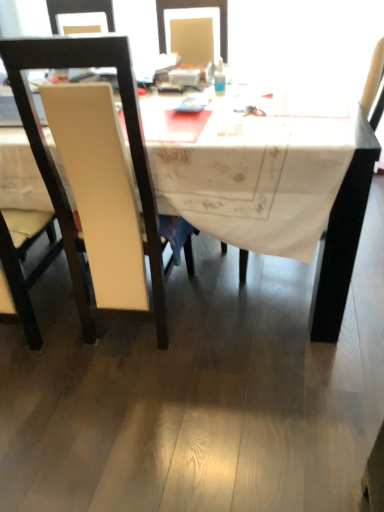
This screenshot has width=384, height=512. What do you see at coordinates (59, 176) in the screenshot?
I see `white leather chair at left, positioned as the 2th chair in left-to-right order` at bounding box center [59, 176].

Locate an element on the screen. translucent plastic bottle at upper center is located at coordinates (219, 79).

Identify the location of white leather chair at left, placed as the first chair when sorted from right to left. (59, 176).

Considering the relative sizes of white fabric table at center and white leather chair at left, placed as the first chair when sorted from right to left, in the image provided, is white fabric table at center wider than white leather chair at left, placed as the first chair when sorted from right to left,?

Yes, white fabric table at center is wider than white leather chair at left, placed as the first chair when sorted from right to left.

Looking at this image, in terms of size, does white fabric table at center appear bigger or smaller than white leather chair at left, placed as the first chair when sorted from right to left?

Clearly, white fabric table at center is larger in size than white leather chair at left, placed as the first chair when sorted from right to left.

Is point (370, 128) farther from viewer compared to point (81, 262)?

No, it is in front of (81, 262).

Could you measure the distance between white leather chair at left, positioned as the 2th chair in left-to-right order, and white fabric table at center?

27.67 inches.

Is white leather chair at left, positioned as the 2th chair in left-to-right order, at the right side of white fabric table at center?

Indeed, white leather chair at left, positioned as the 2th chair in left-to-right order, is positioned on the right side of white fabric table at center.

From a real-world perspective, which is physically above, white leather chair at left, placed as the first chair when sorted from right to left, or white fabric table at center?

white leather chair at left, placed as the first chair when sorted from right to left, from a real-world perspective.

Is point (36, 41) positioned in front of point (362, 124)?

Yes, it is in front of point (362, 124).

From the image's perspective, is translucent plastic bottle at upper center positioned above or below white leather chair at left, positioned as the 2th chair in left-to-right order?

translucent plastic bottle at upper center is above white leather chair at left, positioned as the 2th chair in left-to-right order.

Which of these two, translucent plastic bottle at upper center or white leather chair at left, positioned as the 2th chair in left-to-right order, is smaller?

translucent plastic bottle at upper center is smaller.

Which is behind, translucent plastic bottle at upper center or white leather chair at left, placed as the first chair when sorted from right to left?

Positioned behind is translucent plastic bottle at upper center.

How far apart are translucent plastic bottle at upper center and white leather chair at left, placed as the first chair when sorted from right to left?

translucent plastic bottle at upper center is 29.55 inches away from white leather chair at left, placed as the first chair when sorted from right to left.

How different are the orientations of white matte chair at left, which is the 2th chair in right-to-left order, and translucent plastic bottle at upper center in degrees?

The facing directions of white matte chair at left, which is the 2th chair in right-to-left order, and translucent plastic bottle at upper center are 5.8 degrees apart.

Image resolution: width=384 pixels, height=512 pixels. I want to click on bottle behind the white matte chair at left, the first chair in the left-to-right sequence, so (219, 79).

Considering the points (18, 42) and (217, 77), which point is behind, point (18, 42) or point (217, 77)?

The point (217, 77) is farther.

Considering the sizes of objects white leather chair at left, placed as the first chair when sorted from right to left, and white matte chair at left, the first chair in the left-to-right sequence, in the image provided, who is bigger, white leather chair at left, placed as the first chair when sorted from right to left, or white matte chair at left, the first chair in the left-to-right sequence,?

white leather chair at left, placed as the first chair when sorted from right to left, is bigger.

Is white leather chair at left, positioned as the 2th chair in left-to-right order, oriented towards white matte chair at left, the first chair in the left-to-right sequence?

No, white leather chair at left, positioned as the 2th chair in left-to-right order, is not oriented towards white matte chair at left, the first chair in the left-to-right sequence.

Is white leather chair at left, placed as the first chair when sorted from right to left, positioned far away from white matte chair at left, which is the 2th chair in right-to-left order?

They are positioned close to each other.

From a real-world perspective, is translucent plastic bottle at upper center physically located above or below white fabric table at center?

In terms of real-world spatial position, translucent plastic bottle at upper center is above white fabric table at center.

Is translucent plastic bottle at upper center aimed at white fabric table at center?

No, translucent plastic bottle at upper center is not turned towards white fabric table at center.

You are a GUI agent. You are given a task and a screenshot of the screen. Output one action in this format:
    pyautogui.click(x=<x>, y=<y>)
    Task: Click on the desk below the translucent plastic bottle at upper center (from the image's perspective)
    The width and height of the screenshot is (384, 512).
    Given the screenshot: What is the action you would take?
    pyautogui.click(x=343, y=237)

Is the depth of translucent plastic bottle at upper center greater than that of white fabric table at center?

Yes, it is behind white fabric table at center.

Choose the correct answer: Is white fabric table at center inside translucent plastic bottle at upper center or outside it?

white fabric table at center is not enclosed by translucent plastic bottle at upper center.

Is white fabric table at center placed right next to translucent plastic bottle at upper center?

white fabric table at center and translucent plastic bottle at upper center are clearly separated.

From a real-world perspective, is white fabric table at center under translucent plastic bottle at upper center?

Yes, from a real-world perspective, white fabric table at center is below translucent plastic bottle at upper center.

What's the angular difference between white fabric table at center and translucent plastic bottle at upper center's facing directions?

The angular difference between white fabric table at center and translucent plastic bottle at upper center is 5.33 degrees.

Identify the location of desk behind the white leather chair at left, positioned as the 2th chair in left-to-right order. (343, 237).

From the image's perspective, starting from the white fabric table at center, which chair is the 1st one below? Please provide its 2D coordinates.

[(59, 176)]

Which object lies further to the anchor point white matte chair at left, the first chair in the left-to-right sequence, white fabric table at center or white leather chair at left, positioned as the 2th chair in left-to-right order?

white fabric table at center lies further to white matte chair at left, the first chair in the left-to-right sequence, than the other object.

Considering their positions, is translucent plastic bottle at upper center positioned further to white matte chair at left, which is the 2th chair in right-to-left order, than white leather chair at left, placed as the first chair when sorted from right to left?

translucent plastic bottle at upper center lies further to white matte chair at left, which is the 2th chair in right-to-left order, than the other object.

From the picture: Considering their positions, is white matte chair at left, the first chair in the left-to-right sequence, positioned further to translucent plastic bottle at upper center than white leather chair at left, placed as the first chair when sorted from right to left?

The object further to translucent plastic bottle at upper center is white matte chair at left, the first chair in the left-to-right sequence.

From the image, which object appears to be farther from white leather chair at left, positioned as the 2th chair in left-to-right order, translucent plastic bottle at upper center or white fabric table at center?

Among the two, translucent plastic bottle at upper center is located further to white leather chair at left, positioned as the 2th chair in left-to-right order.

From the image, which object appears to be nearer to white leather chair at left, positioned as the 2th chair in left-to-right order, white matte chair at left, the first chair in the left-to-right sequence, or translucent plastic bottle at upper center?

white matte chair at left, the first chair in the left-to-right sequence.

Considering their positions, is white fabric table at center positioned further to white matte chair at left, which is the 2th chair in right-to-left order, than translucent plastic bottle at upper center?

white fabric table at center lies further to white matte chair at left, which is the 2th chair in right-to-left order, than the other object.

Estimate the real-world distances between objects in this image. Which object is further from white fabric table at center, translucent plastic bottle at upper center or white matte chair at left, the first chair in the left-to-right sequence?

Among the two, white matte chair at left, the first chair in the left-to-right sequence, is located further to white fabric table at center.

Considering their positions, is white fabric table at center positioned closer to translucent plastic bottle at upper center than white leather chair at left, placed as the first chair when sorted from right to left?

white fabric table at center is positioned closer to the anchor translucent plastic bottle at upper center.

This screenshot has width=384, height=512. I want to click on desk between white matte chair at left, which is the 2th chair in right-to-left order, and translucent plastic bottle at upper center, in the horizontal direction, so click(x=343, y=237).

The width and height of the screenshot is (384, 512). What are the coordinates of `desk between white leather chair at left, placed as the first chair when sorted from right to left, and translucent plastic bottle at upper center in the front-back direction` in the screenshot? It's located at (343, 237).

The height and width of the screenshot is (512, 384). I want to click on desk between white matte chair at left, the first chair in the left-to-right sequence, and white leather chair at left, placed as the first chair when sorted from right to left, from left to right, so click(343, 237).

The image size is (384, 512). In order to click on chair between white matte chair at left, which is the 2th chair in right-to-left order, and translucent plastic bottle at upper center in this screenshot , I will do `click(59, 176)`.